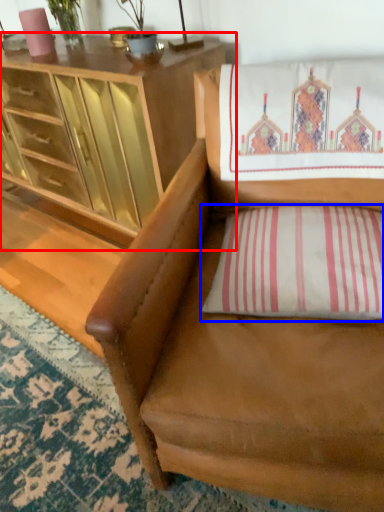
Question: Which object is closer to the camera taking this photo, cabinetry (highlighted by a red box) or pillow (highlighted by a blue box)?

Choices:
 (A) cabinetry
 (B) pillow

Answer: (B)